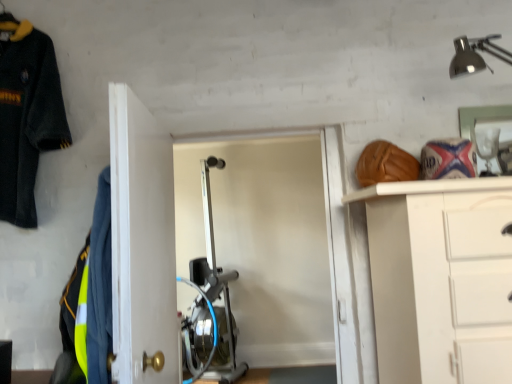
The height and width of the screenshot is (384, 512). Describe the element at coordinates (91, 294) in the screenshot. I see `reflective yellow-green fabric at left, the 2th uniform positioned from the back` at that location.

This screenshot has height=384, width=512. In order to click on dark blue fleece jacket at upper left, positioned as the first uniform in left-to-right order in this screenshot , I will do `click(26, 115)`.

In the scene shown: Is dark blue fleece jacket at upper left, marked as the 1th uniform in a top-to-bottom arrangement, spatially inside reflective yellow-green fabric at left, the first uniform in the front-to-back sequence, or outside of it?

dark blue fleece jacket at upper left, marked as the 1th uniform in a top-to-bottom arrangement, cannot be found inside reflective yellow-green fabric at left, the first uniform in the front-to-back sequence.

Considering the relative sizes of dark blue fleece jacket at upper left, positioned as the first uniform in left-to-right order, and reflective yellow-green fabric at left, arranged as the second uniform when viewed from the top, in the image provided, is dark blue fleece jacket at upper left, positioned as the first uniform in left-to-right order, taller than reflective yellow-green fabric at left, arranged as the second uniform when viewed from the top,?

Yes.

Is dark blue fleece jacket at upper left, which is the second uniform in bottom-to-top order, positioned with its back to reflective yellow-green fabric at left, the first uniform in the front-to-back sequence?

No, dark blue fleece jacket at upper left, which is the second uniform in bottom-to-top order,'s orientation is not away from reflective yellow-green fabric at left, the first uniform in the front-to-back sequence.

Is point (33, 209) closer or farther from the camera than point (69, 279)?

Point (33, 209) is farther from the camera than point (69, 279).

From the image's perspective, is reflective yellow-green fabric at left, which ranks as the second uniform in left-to-right order, located above dark blue fleece jacket at upper left, which is the second uniform in bottom-to-top order?

Actually, reflective yellow-green fabric at left, which ranks as the second uniform in left-to-right order, appears below dark blue fleece jacket at upper left, which is the second uniform in bottom-to-top order, in the image.

Can you tell me how much reflective yellow-green fabric at left, the 2th uniform positioned from the back, and dark blue fleece jacket at upper left, positioned as the first uniform in left-to-right order, differ in facing direction?

The angle between the facing direction of reflective yellow-green fabric at left, the 2th uniform positioned from the back, and the facing direction of dark blue fleece jacket at upper left, positioned as the first uniform in left-to-right order, is 73.2 degrees.

From a real-world perspective, is reflective yellow-green fabric at left, which ranks as the second uniform in left-to-right order, positioned above or below dark blue fleece jacket at upper left, which is the second uniform in bottom-to-top order?

From a real-world perspective, reflective yellow-green fabric at left, which ranks as the second uniform in left-to-right order, is physically below dark blue fleece jacket at upper left, which is the second uniform in bottom-to-top order.

Which of these two, reflective yellow-green fabric at left, which ranks as the second uniform in left-to-right order, or dark blue fleece jacket at upper left, the second uniform positioned from the right, is thinner?

reflective yellow-green fabric at left, which ranks as the second uniform in left-to-right order.

Looking at this image, from the image's perspective, is white glossy door at center on top of dark blue fleece jacket at upper left, marked as the 1th uniform in a top-to-bottom arrangement?

No.

From a real-world perspective, between white glossy door at center and dark blue fleece jacket at upper left, arranged as the 2th uniform when viewed from the front, who is vertically lower?

From a 3D spatial view, white glossy door at center is below.

Which point is more distant from viewer, (144, 274) or (17, 104)?

The point (17, 104) is farther from the camera.

Is white glossy door at center positioned behind reflective yellow-green fabric at left, arranged as the second uniform when viewed from the top?

No, it is in front of reflective yellow-green fabric at left, arranged as the second uniform when viewed from the top.

Can you tell me how much white glossy door at center and reflective yellow-green fabric at left, the 2th uniform positioned from the back, differ in facing direction?

There is a 163-degree angle between the facing directions of white glossy door at center and reflective yellow-green fabric at left, the 2th uniform positioned from the back.

Which object is thinner, white glossy door at center or reflective yellow-green fabric at left, the 1th uniform when ordered from right to left?

Thinner between the two is white glossy door at center.

Is point (164, 328) positioned before point (100, 211)?

No, it is not.

Which is closer, (106, 276) or (127, 212)?

Point (106, 276) is positioned farther from the camera compared to point (127, 212).

Is reflective yellow-green fabric at left, the 2th uniform positioned from the back, wider or thinner than white glossy door at center?

Considering their sizes, reflective yellow-green fabric at left, the 2th uniform positioned from the back, looks broader than white glossy door at center.

Consider the image. Can you confirm if reflective yellow-green fabric at left, the first uniform in the front-to-back sequence, is shorter than white glossy door at center?

Yes.

From the image's perspective, is reflective yellow-green fabric at left, the first uniform in the front-to-back sequence, under white glossy door at center?

Yes, from the image's perspective, reflective yellow-green fabric at left, the first uniform in the front-to-back sequence, is beneath white glossy door at center.

From a real-world perspective, is dark blue fleece jacket at upper left, the second uniform positioned from the right, located higher than white glossy door at center?

Yes, from a real-world perspective, dark blue fleece jacket at upper left, the second uniform positioned from the right, is over white glossy door at center

Can you confirm if dark blue fleece jacket at upper left, which ranks as the first uniform in back-to-front order, is smaller than white glossy door at center?

Indeed, dark blue fleece jacket at upper left, which ranks as the first uniform in back-to-front order, has a smaller size compared to white glossy door at center.

Is dark blue fleece jacket at upper left, which is the second uniform in bottom-to-top order, facing towards white glossy door at center?

No, dark blue fleece jacket at upper left, which is the second uniform in bottom-to-top order, does not turn towards white glossy door at center.

From the image's perspective, does dark blue fleece jacket at upper left, marked as the 1th uniform in a top-to-bottom arrangement, appear higher than white glossy door at center?

Yes.

The width and height of the screenshot is (512, 384). I want to click on uniform beneath the dark blue fleece jacket at upper left, the second uniform positioned from the right (from a real-world perspective), so click(91, 294).

Locate an element on the screen. uniform above the reflective yellow-green fabric at left, the first uniform in the front-to-back sequence (from the image's perspective) is located at coordinates (26, 115).

Estimate the real-world distances between objects in this image. Which object is further from dark blue fleece jacket at upper left, which ranks as the first uniform in back-to-front order, reflective yellow-green fabric at left, which ranks as the second uniform in left-to-right order, or white glossy door at center?

reflective yellow-green fabric at left, which ranks as the second uniform in left-to-right order.

Based on their spatial positions, is dark blue fleece jacket at upper left, marked as the 1th uniform in a top-to-bottom arrangement, or reflective yellow-green fabric at left, arranged as the second uniform when viewed from the top, further from white glossy door at center?

dark blue fleece jacket at upper left, marked as the 1th uniform in a top-to-bottom arrangement, is further to white glossy door at center.

Which object lies further to the anchor point dark blue fleece jacket at upper left, positioned as the first uniform in left-to-right order, white glossy door at center or reflective yellow-green fabric at left, the 2th uniform positioned from the back?

Among the two, reflective yellow-green fabric at left, the 2th uniform positioned from the back, is located further to dark blue fleece jacket at upper left, positioned as the first uniform in left-to-right order.

Looking at the image, which one is located further to white glossy door at center, reflective yellow-green fabric at left, the first uniform when ordered from bottom to top, or dark blue fleece jacket at upper left, which ranks as the first uniform in back-to-front order?

dark blue fleece jacket at upper left, which ranks as the first uniform in back-to-front order, lies further to white glossy door at center than the other object.

Looking at the image, which one is located further to reflective yellow-green fabric at left, which ranks as the second uniform in left-to-right order, dark blue fleece jacket at upper left, arranged as the 2th uniform when viewed from the front, or white glossy door at center?

dark blue fleece jacket at upper left, arranged as the 2th uniform when viewed from the front, is positioned further to the anchor reflective yellow-green fabric at left, which ranks as the second uniform in left-to-right order.

From the image, which object appears to be farther from reflective yellow-green fabric at left, the 2th uniform positioned from the back, white glossy door at center or dark blue fleece jacket at upper left, marked as the 1th uniform in a top-to-bottom arrangement?

The object further to reflective yellow-green fabric at left, the 2th uniform positioned from the back, is dark blue fleece jacket at upper left, marked as the 1th uniform in a top-to-bottom arrangement.

Locate an element on the screen. door between dark blue fleece jacket at upper left, which is the second uniform in bottom-to-top order, and reflective yellow-green fabric at left, the first uniform when ordered from bottom to top, from top to bottom is located at coordinates (142, 242).